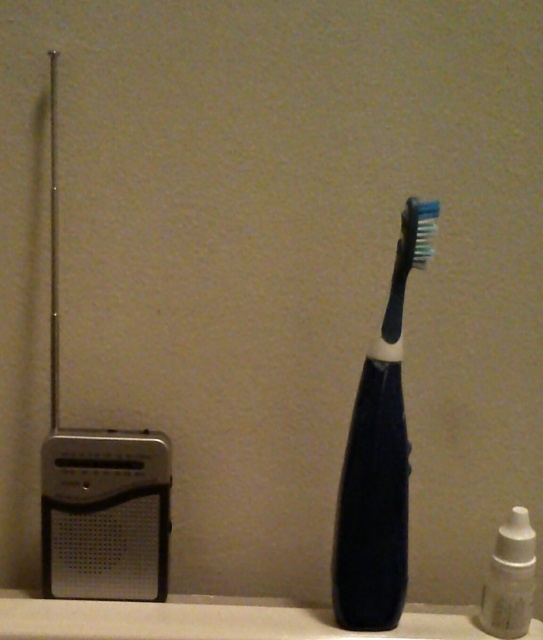
You are standing in front of a beige wall with a vintage radio on the left and an electric toothbrush in the center. There is a point marked at coordinates [378,460]. Which object is this point located on?

The point at coordinates [378,460] is on the black rubberized toothbrush at center.

You are organizing items on a shelf and need to place the black rubberized toothbrush at center and the white plastic bottle at lower right. Based on their positions in the image, which item is closer to the left edge of the shelf?

The black rubberized toothbrush at center is closer to the left edge of the shelf because it is positioned to the left of the white plastic bottle at lower right.

You are organizing a small shelf in a bathroom. You have a black rubberized toothbrush at center and a white plastic bottle at lower right. The distance between them is 5.46 inches. If you want to place a decorative vase that requires 6 inches of space between them, will the current spacing be sufficient?

The black rubberized toothbrush at center and the white plastic bottle at lower right are 5.46 inches apart, which is less than the required 6 inches. Therefore, the current spacing is insufficient for placing the decorative vase between them.